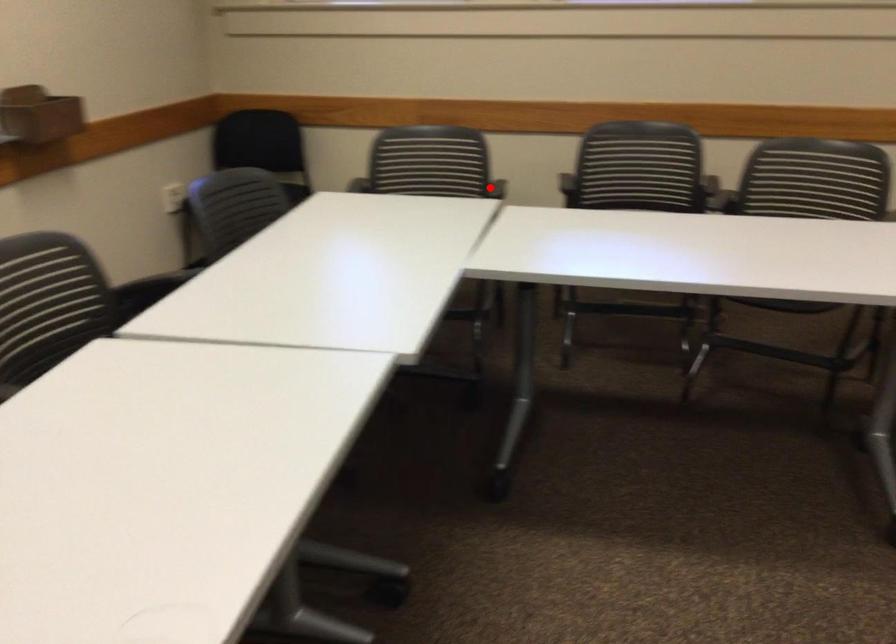
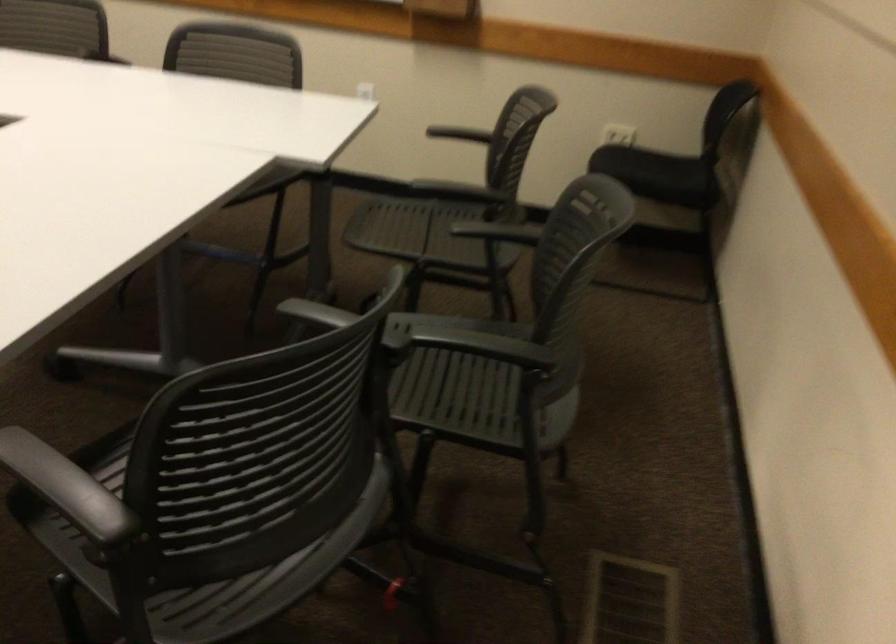
Question: I am providing you with two images of the same scene from different viewpoints. Given a red point in image1, look at the same physical point in image2. Is it:

Choices:
 (A) Closer to the viewpoint
 (B) Farther from the viewpoint

Answer: (A)